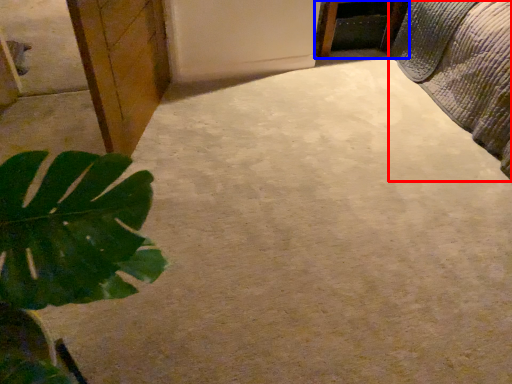
Question: Which of the following is the farthest to the observer, bed (highlighted by a red box) or furniture (highlighted by a blue box)?

Choices:
 (A) bed
 (B) furniture

Answer: (B)